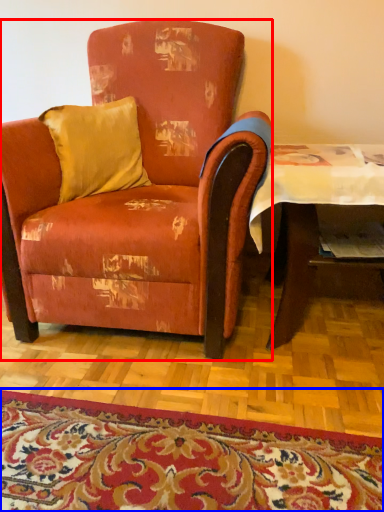
Question: Which of the following is the farthest to the observer, chair (highlighted by a red box) or mat (highlighted by a blue box)?

Choices:
 (A) chair
 (B) mat

Answer: (A)